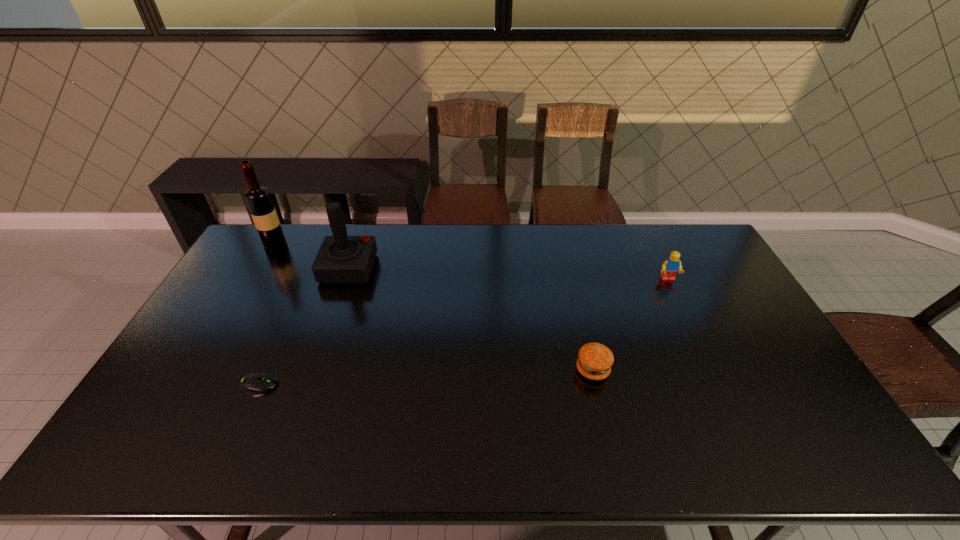
You are a GUI agent. You are given a task and a screenshot of the screen. Output one action in this format:
    pyautogui.click(x=<x>, y=<y>)
    Task: Click on the wine bottle
    
    Given the screenshot: What is the action you would take?
    pyautogui.click(x=258, y=198)

Find the location of a particular element. the leftmost object is located at coordinates (258, 198).

Identify the location of the second tallest object. (341, 259).

In order to click on Lego in this screenshot , I will do `click(672, 265)`.

Locate an element on the screen. The height and width of the screenshot is (540, 960). the third shortest object is located at coordinates (672, 265).

Locate an element on the screen. the second shortest object is located at coordinates (595, 360).

At what (x,y) coordinates should I click in order to perform the action: click on patty. Please return your answer as a coordinate pair (x, y). The width and height of the screenshot is (960, 540). Looking at the image, I should click on (595, 360).

Where is `computer mouse`? computer mouse is located at coordinates (254, 382).

I want to click on vacant space located on the right of the wine bottle, so click(325, 244).

In order to click on vacant space located on the base of the second tallest object in this screenshot , I will do `click(405, 268)`.